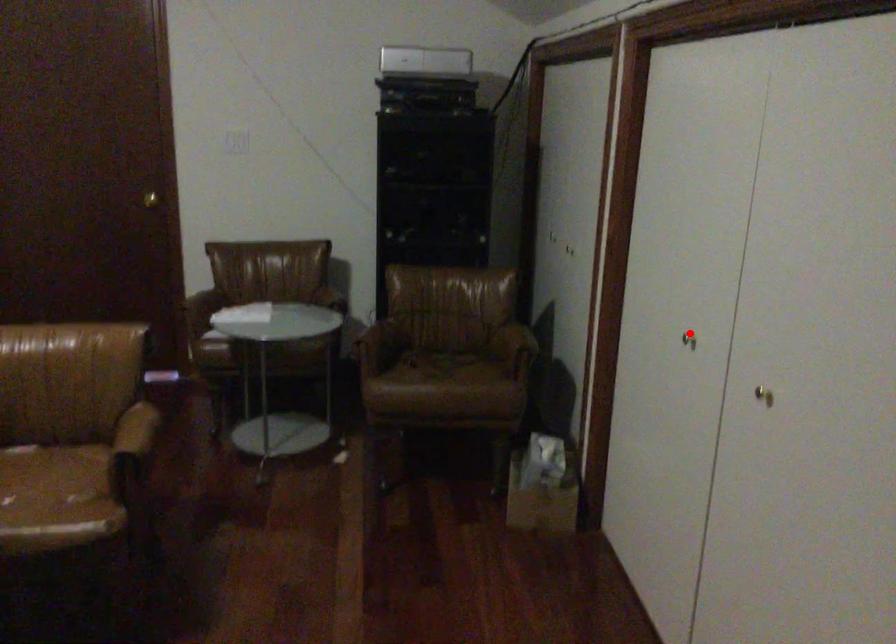
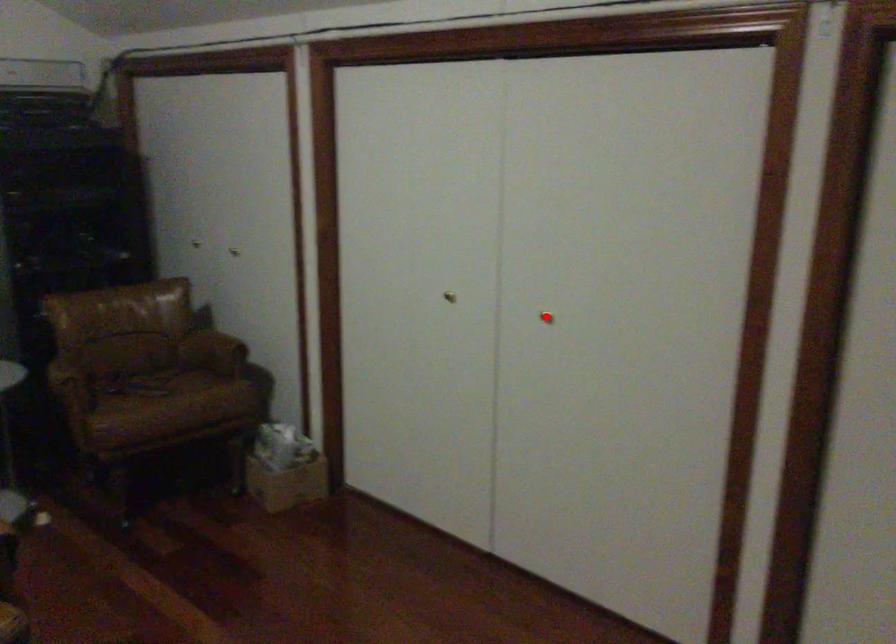
Consider the image. I am providing you with two images of the same scene from different viewpoints. A red point is marked on the first image and another point is marked on the second image. Are the points marked in image1 and image2 representing the same 3D position?

No